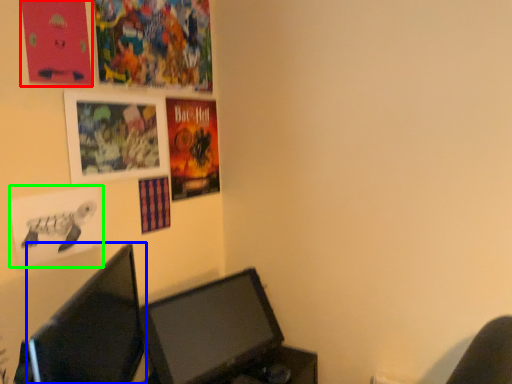
Question: Based on their relative distances, which object is farther from poster page (highlighted by a red box)? Choose from computer monitor (highlighted by a blue box) and poster page (highlighted by a green box).

Choices:
 (A) computer monitor
 (B) poster page

Answer: (A)